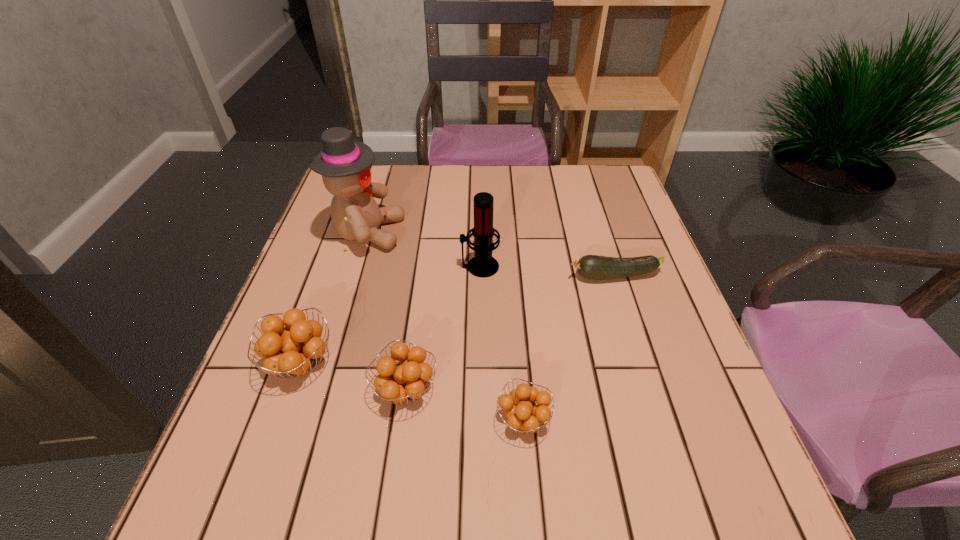
Locate an element on the screen. The height and width of the screenshot is (540, 960). rag_doll present at the left edge is located at coordinates (345, 165).

This screenshot has width=960, height=540. What are the coordinates of `object that is at the right edge` in the screenshot? It's located at (594, 267).

This screenshot has width=960, height=540. I want to click on object situated at the far left corner, so click(345, 165).

In the image, there is a desktop. Identify the location of vacant space at the far edge. (409, 190).

In order to click on vacant area at the near edge of the desktop in this screenshot , I will do `click(446, 413)`.

The image size is (960, 540). I want to click on vacant space at the left edge, so click(294, 279).

The height and width of the screenshot is (540, 960). What are the coordinates of `vacant space at the right edge` in the screenshot? It's located at (628, 340).

In order to click on free region at the far right corner of the desktop in this screenshot , I will do `click(579, 202)`.

Identify the location of free spot at the near right corner of the desktop. (665, 456).

Image resolution: width=960 pixels, height=540 pixels. Find the location of `vacant area that lies between the rag_doll and the second orange fruit from right to left`. vacant area that lies between the rag_doll and the second orange fruit from right to left is located at coordinates (387, 311).